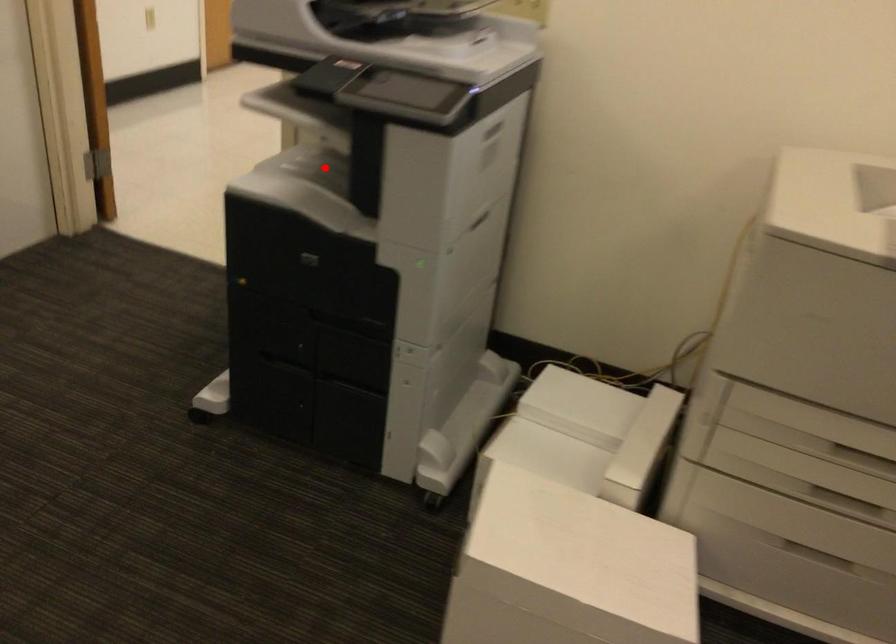
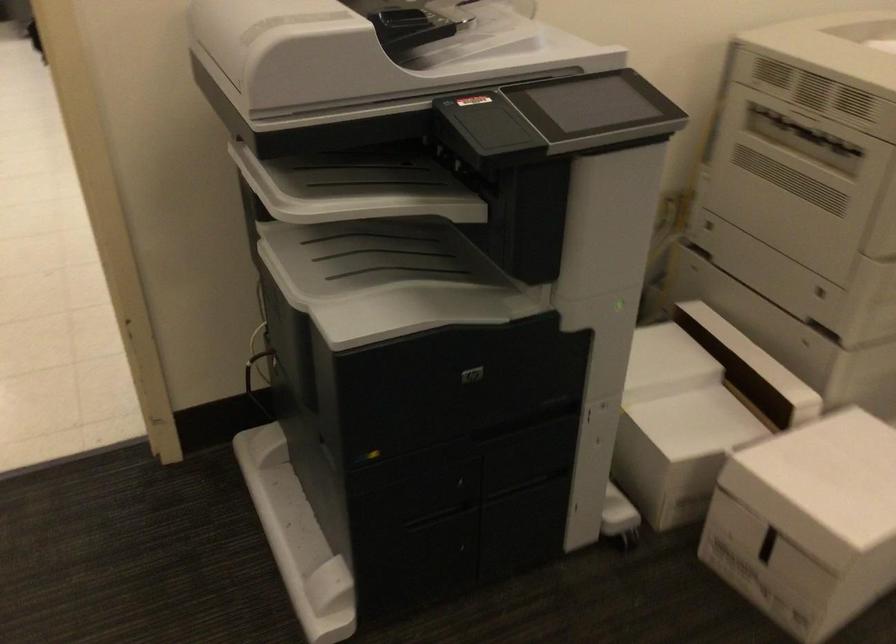
Question: I am providing you with two images of the same scene from different viewpoints. Image1 has a red point marked. In image2, the corresponding 3D location appears at what relative position? Reply with the corresponding letter.

Choices:
 (A) Closer
 (B) Farther

Answer: (A)